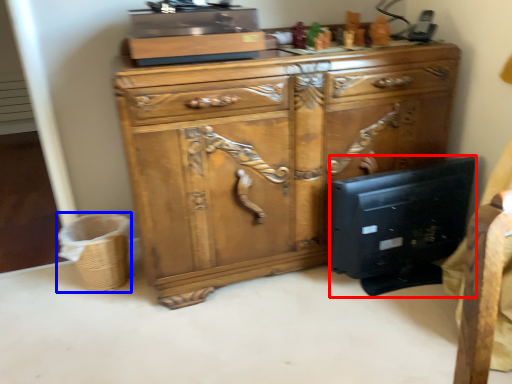
Question: Which point is closer to the camera, desktop computer (highlighted by a red box) or basket (highlighted by a blue box)?

Choices:
 (A) desktop computer
 (B) basket

Answer: (A)